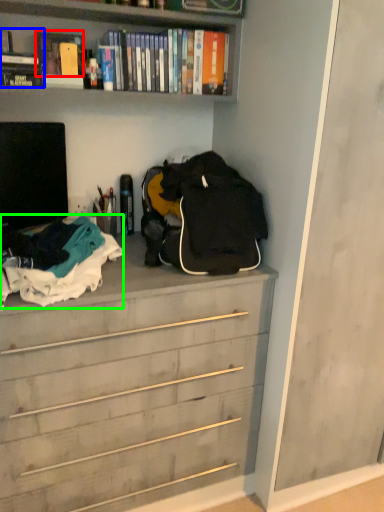
Question: Estimate the real-world distances between objects in this image. Which object is closer to book (highlighted by a red box), book (highlighted by a blue box) or clothing (highlighted by a green box)?

Choices:
 (A) book
 (B) clothing

Answer: (A)